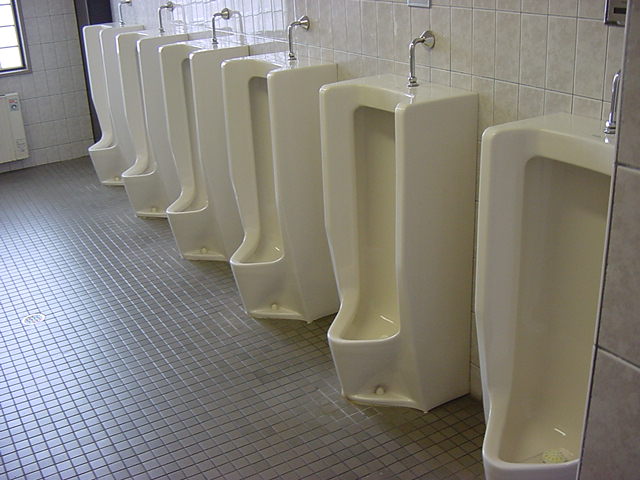
Find the location of a particular element. This screenshot has width=640, height=480. urinals is located at coordinates (554, 307), (383, 230), (271, 183), (193, 135), (138, 111), (98, 98).